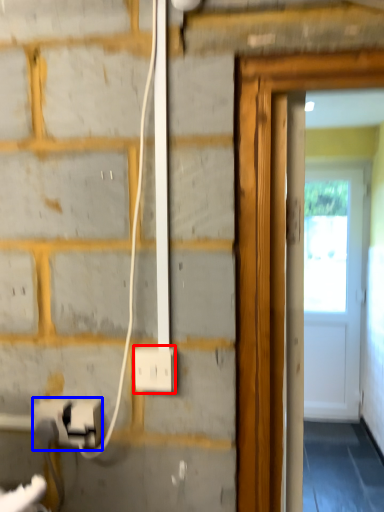
Question: Which point is closer to the camera, power plugs and sockets (highlighted by a red box) or electric outlet (highlighted by a blue box)?

Choices:
 (A) power plugs and sockets
 (B) electric outlet

Answer: (A)